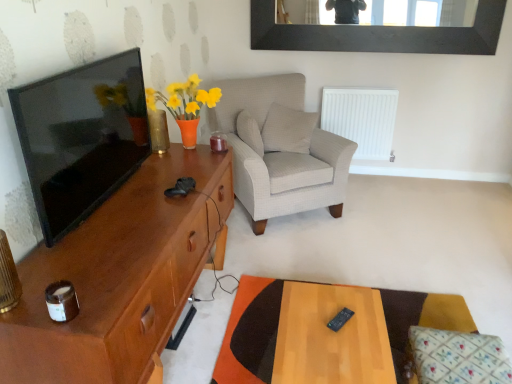
The image size is (512, 384). In order to click on free space to the back side of wooden rectangular table at center in this screenshot , I will do `click(300, 283)`.